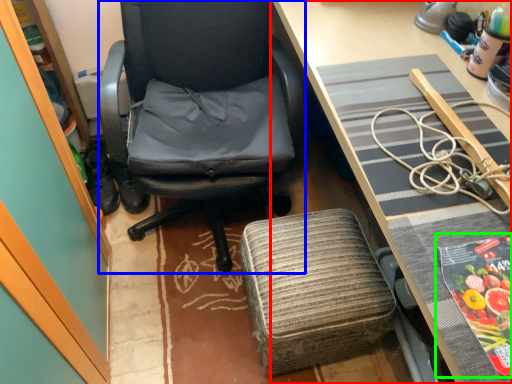
Question: Which object is the farthest from desk (highlighted by a red box)? Choose among these: chair (highlighted by a blue box) or paperback book (highlighted by a green box).

Choices:
 (A) chair
 (B) paperback book

Answer: (A)